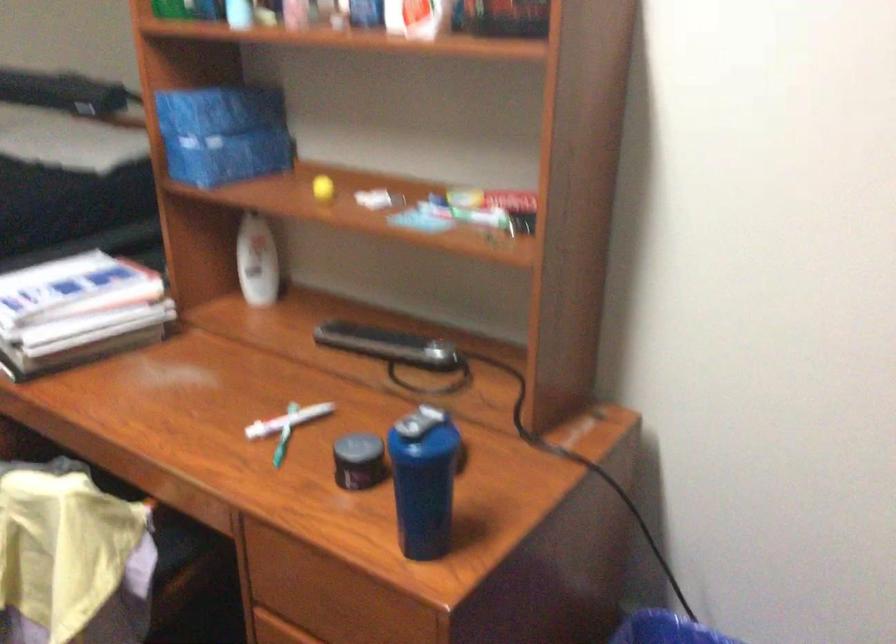
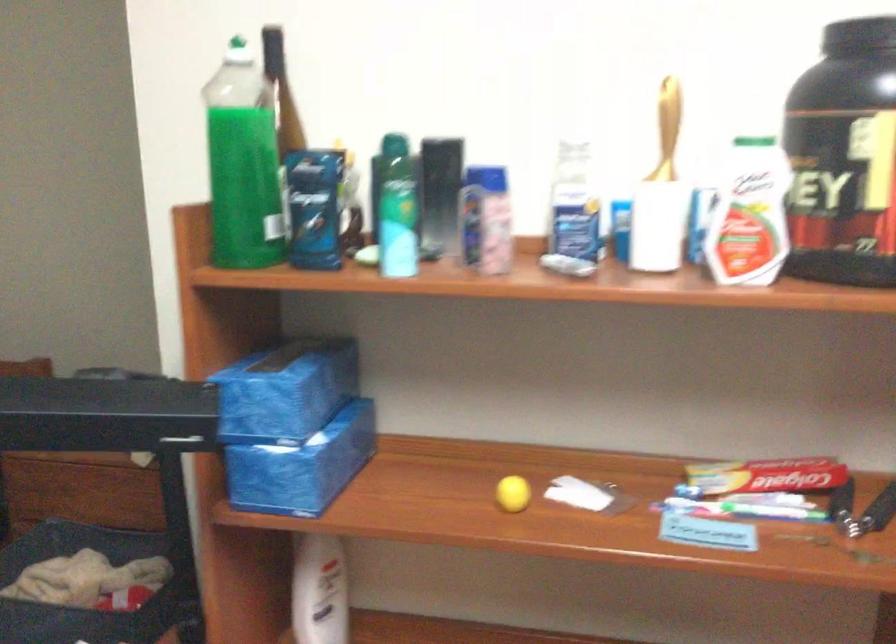
What movement of the cameraman would produce the second image?

The cameraman moved toward left, forward.